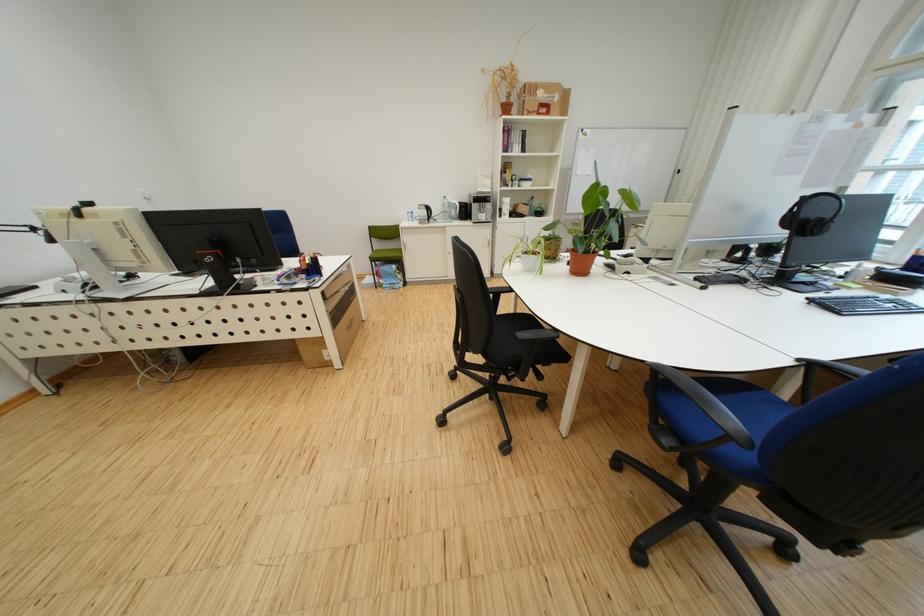
Where would you lift the white plant pot? Please return your answer as a coordinate pair (x, y).

(530, 262)